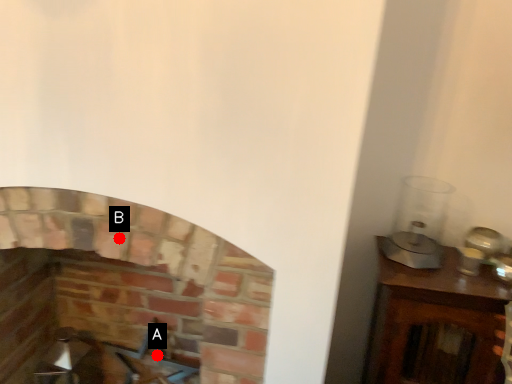
Question: Two points are circled on the image, labeled by A and B beside each circle. Which point appears closest to the camera in this image?

Choices:
 (A) A is closer
 (B) B is closer

Answer: (B)